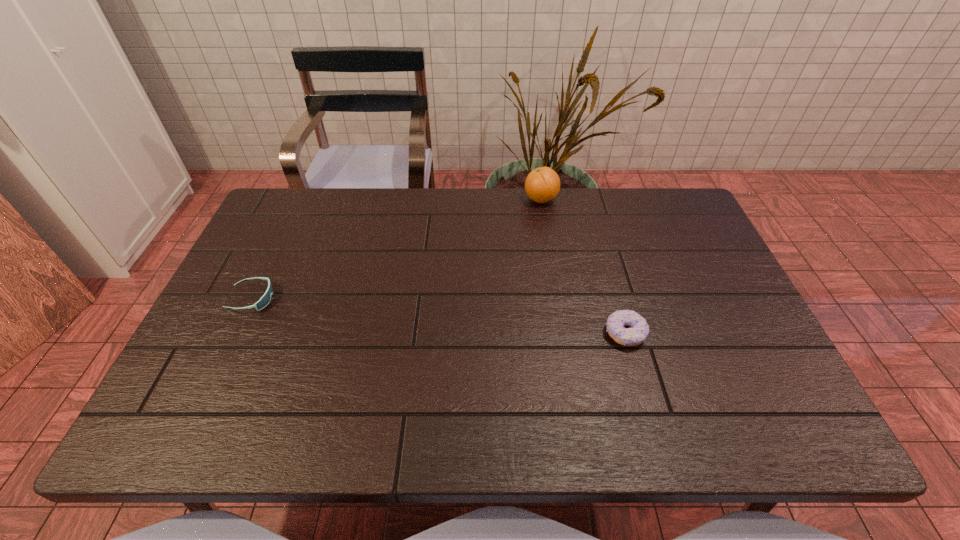
The height and width of the screenshot is (540, 960). Find the location of `free space that satisfies the following two spatial constraints: 1. on the front-facing side of the second tallest object; 2. on the right side of the leftmost object`. free space that satisfies the following two spatial constraints: 1. on the front-facing side of the second tallest object; 2. on the right side of the leftmost object is located at coordinates (235, 333).

Identify the location of vacant region that satisfies the following two spatial constraints: 1. on the front side of the second shortest object; 2. on the right side of the farthest object. This screenshot has height=540, width=960. (563, 333).

Locate an element on the screen. vacant space that satisfies the following two spatial constraints: 1. on the front-facing side of the leftmost object; 2. on the back side of the second tallest object is located at coordinates [235, 333].

Find the location of a particular element. The height and width of the screenshot is (540, 960). free point that satisfies the following two spatial constraints: 1. on the front side of the orange; 2. on the right side of the nearest object is located at coordinates (563, 333).

The width and height of the screenshot is (960, 540). What are the coordinates of `free space that satisfies the following two spatial constraints: 1. on the front-facing side of the goggles; 2. on the right side of the nearest object` in the screenshot? It's located at (235, 333).

Where is `vacant region that satisfies the following two spatial constraints: 1. on the front-facing side of the goggles; 2. on the left side of the second tallest object`? The height and width of the screenshot is (540, 960). vacant region that satisfies the following two spatial constraints: 1. on the front-facing side of the goggles; 2. on the left side of the second tallest object is located at coordinates (235, 333).

Where is `free space that satisfies the following two spatial constraints: 1. on the front-facing side of the second tallest object; 2. on the right side of the shortest object`? The width and height of the screenshot is (960, 540). free space that satisfies the following two spatial constraints: 1. on the front-facing side of the second tallest object; 2. on the right side of the shortest object is located at coordinates (235, 333).

This screenshot has height=540, width=960. In order to click on vacant space that satisfies the following two spatial constraints: 1. on the front side of the second shortest object; 2. on the right side of the second object from left to right in this screenshot , I will do `click(563, 333)`.